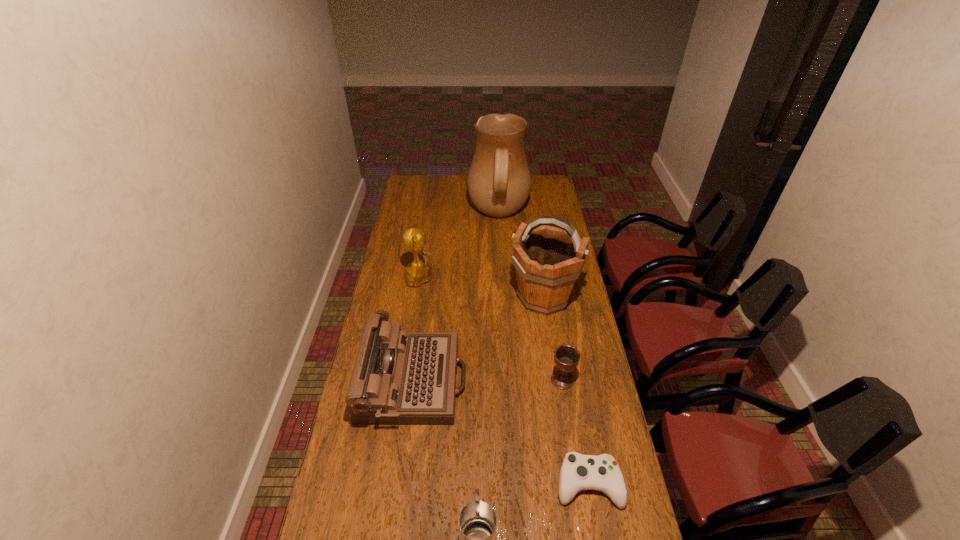
The width and height of the screenshot is (960, 540). I want to click on free space at the far edge of the desktop, so click(x=450, y=186).

Locate an element on the screen. The image size is (960, 540). free space at the left edge is located at coordinates (416, 204).

Locate an element on the screen. The width and height of the screenshot is (960, 540). vacant space at the right edge of the desktop is located at coordinates (566, 315).

Find the location of a particular element. Image resolution: width=960 pixels, height=540 pixels. free space between the shortest object and the chalice is located at coordinates (575, 432).

Identify the location of vacant space that is in between the control and the chalice. (575, 432).

You are a GUI agent. You are given a task and a screenshot of the screen. Output one action in this format:
    pyautogui.click(x=<x>, y=<y>)
    Task: Click on the unoccupied area between the cream pitcher and the typewriter
    The width and height of the screenshot is (960, 540).
    Given the screenshot: What is the action you would take?
    pyautogui.click(x=456, y=298)

The image size is (960, 540). I want to click on vacant area between the chalice and the fifth shortest object, so click(x=493, y=328).

Locate an element on the screen. The height and width of the screenshot is (540, 960). blank region between the control and the cream pitcher is located at coordinates (543, 349).

Where is `empty space between the fifth shortest object and the chalice`? The image size is (960, 540). empty space between the fifth shortest object and the chalice is located at coordinates (x=493, y=328).

Find the location of a particular element. The width and height of the screenshot is (960, 540). vacant region between the second tallest object and the chalice is located at coordinates (553, 339).